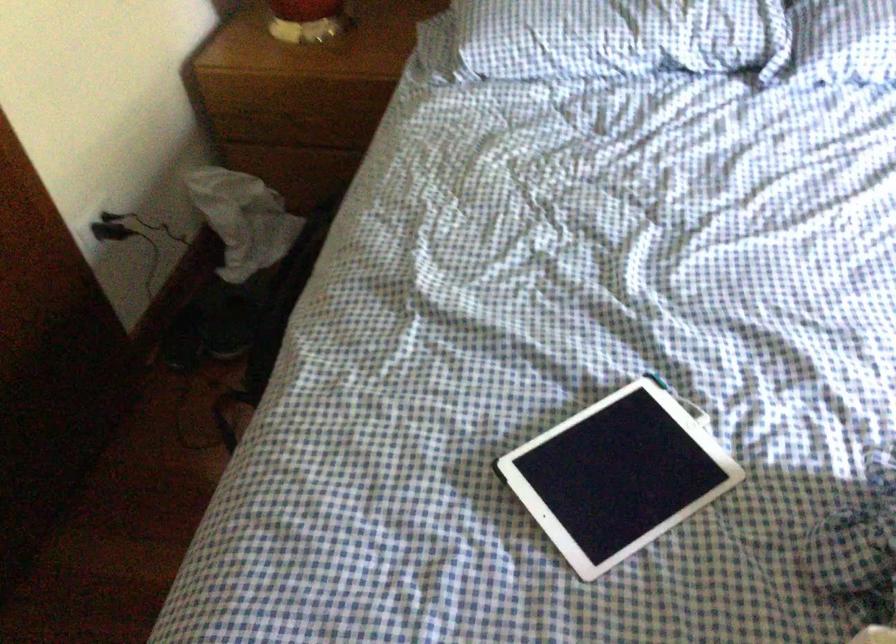
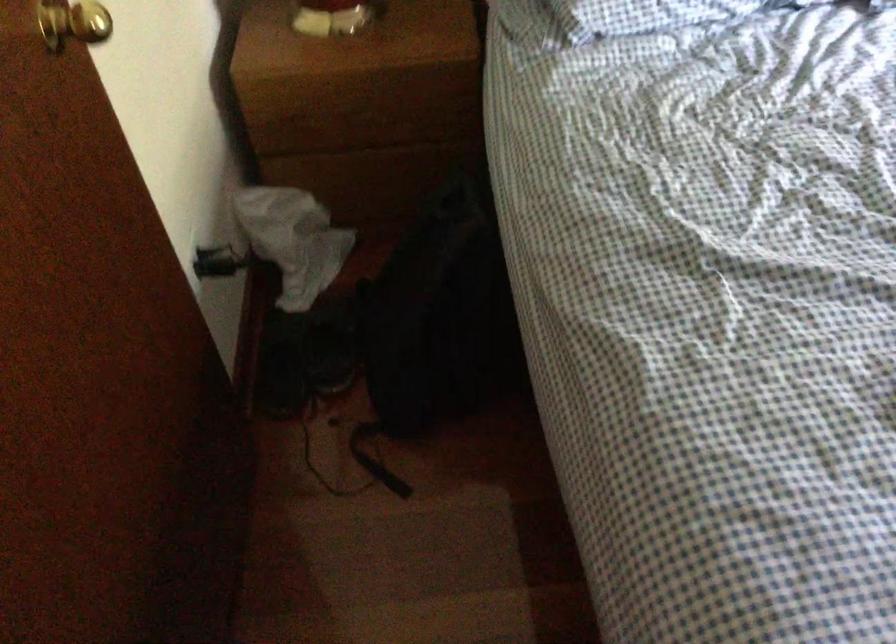
Question: In a continuous first-person perspective shot, in which direction is the camera moving?

Choices:
 (A) Left
 (B) Right
 (C) Forward
 (D) Backward

Answer: (A)